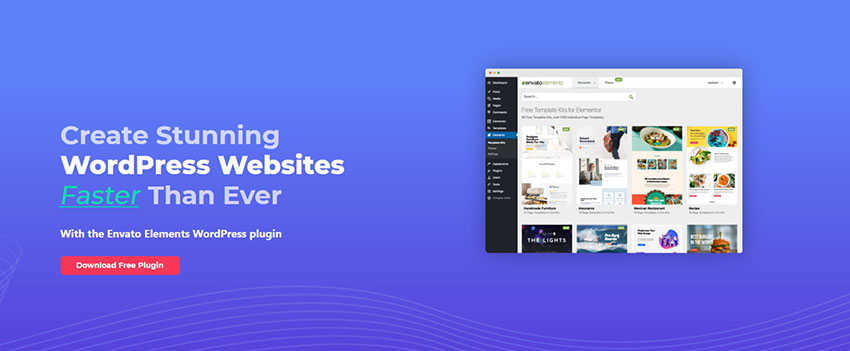
The height and width of the screenshot is (351, 850). I want to click on bowl of food, so click(x=664, y=138).